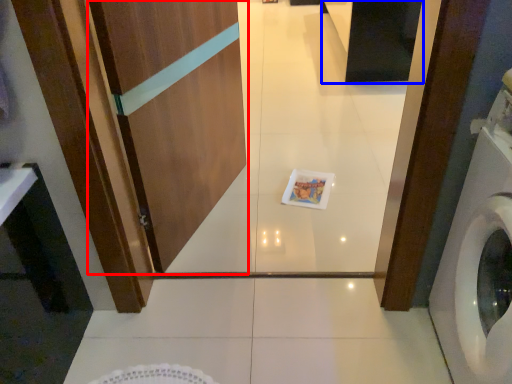
Question: Among these objects, which one is nearest to the camera, screen door (highlighted by a red box) or cabinetry (highlighted by a blue box)?

Choices:
 (A) screen door
 (B) cabinetry

Answer: (A)